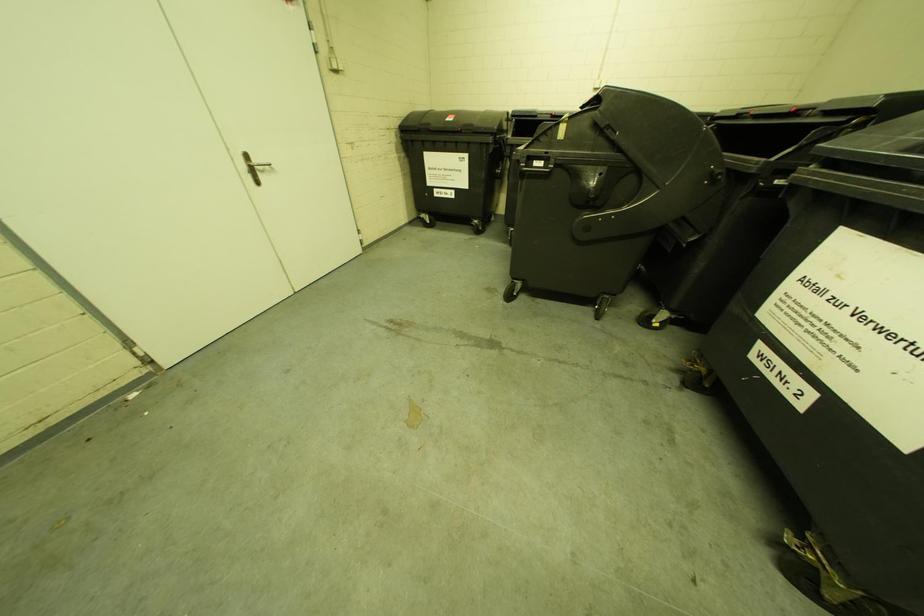
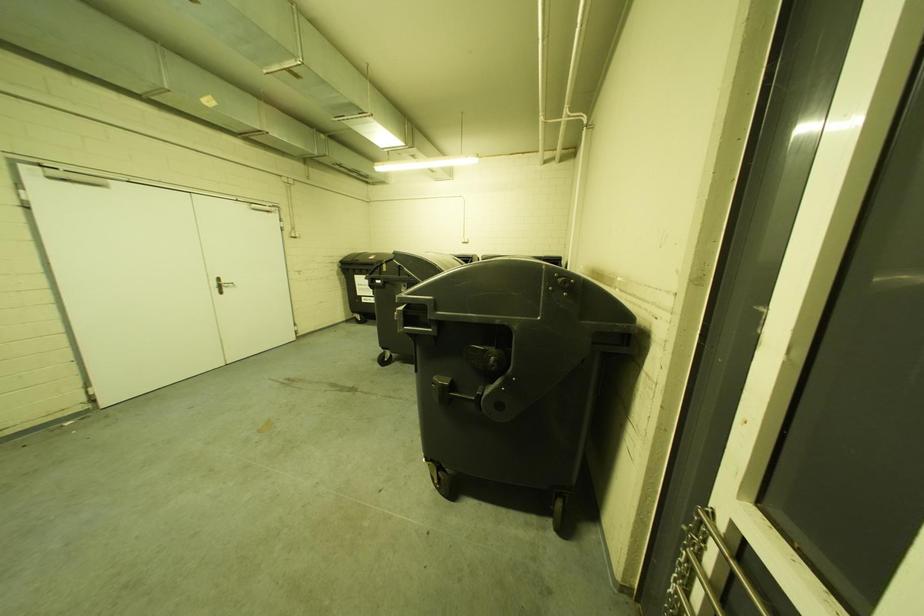
The images are taken continuously from a first-person perspective. In which direction are you moving?

The cameraman walked toward right, backward.